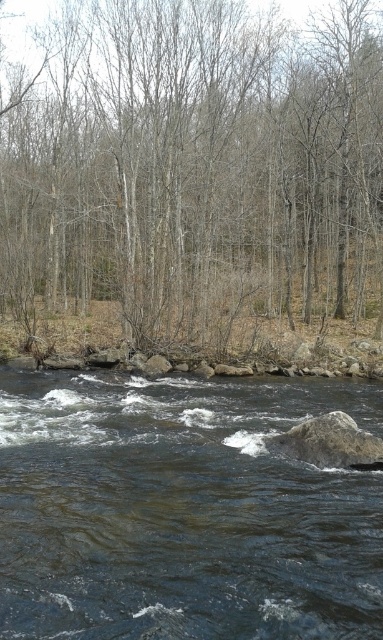
You are standing at the point marked by the coordinates point (x=196, y=168) in the image. Looking around, what object is exactly at your current position?

The brown dry wood trees at center is located at point (x=196, y=168).

You are standing at the edge of the river and want to cross to the other side. The dark brown water at center flows between you and the gray rough rock at center. Which object is wider, making it harder to cross?

The dark brown water at center might be wider than gray rough rock at center, so it could be harder to cross because it is wider.

You are standing at the point with coordinates point [332,460] and want to reach the point with coordinates point [52,74]. According to the scene, which direction should you move to get closer to your destination?

Since point [52,74] is behind point [332,460], you should move forward to reach your destination.